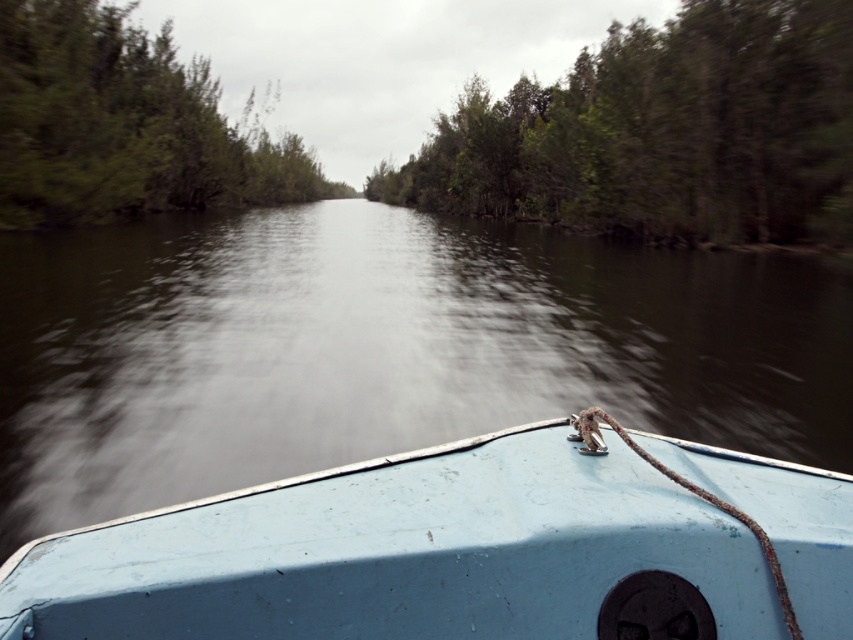
Question: Estimate the real-world distances between objects in this image. Which object is closer to the green leafy trees at left?

Choices:
 (A) dark water at center
 (B) light blue matte boat at center
 (C) green leafy trees at upper center

Answer: (A)

Question: Is dark water at center positioned in front of green leafy trees at upper center?

Choices:
 (A) no
 (B) yes

Answer: (B)

Question: Which point is farther to the camera?

Choices:
 (A) green leafy trees at left
 (B) light blue matte boat at center
 (C) dark water at center

Answer: (A)

Question: Which point is farther to the camera?

Choices:
 (A) (62, 192)
 (B) (527, 184)
 (C) (22, 602)

Answer: (B)

Question: Is dark water at center above green leafy trees at upper center?

Choices:
 (A) yes
 (B) no

Answer: (B)

Question: Is light blue matte boat at center in front of green leafy trees at upper center?

Choices:
 (A) yes
 (B) no

Answer: (A)